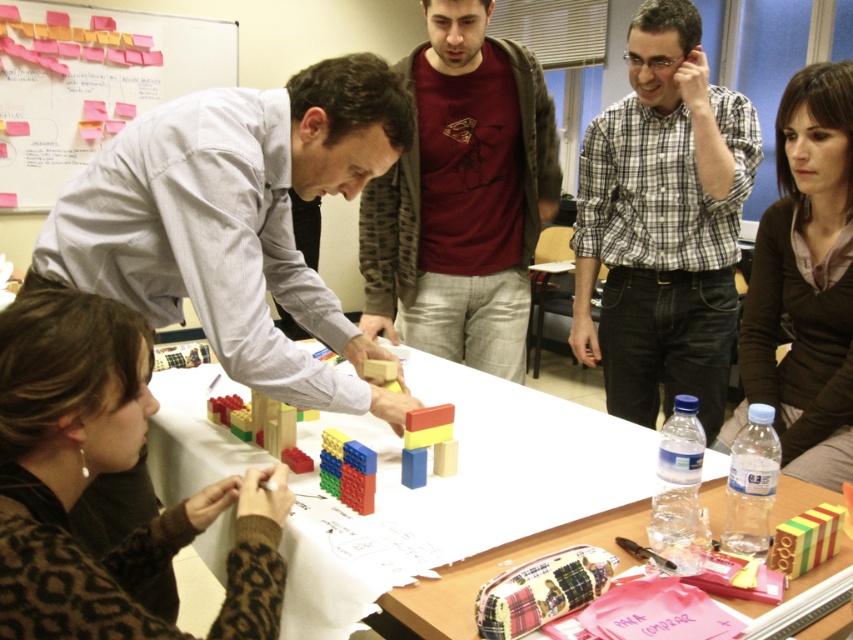
Which is more to the right, maroon t-shirt at center or rubberized plastic blocks at center?

maroon t-shirt at center is more to the right.

Image resolution: width=853 pixels, height=640 pixels. What do you see at coordinates (462, 196) in the screenshot?
I see `maroon t-shirt at center` at bounding box center [462, 196].

Who is more forward, (500, 321) or (444, 451)?

Point (444, 451) is more forward.

Locate an element on the screen. maroon t-shirt at center is located at coordinates (462, 196).

From the picture: Which is more to the left, white plastic table at center or wooden toy blocks at center?

white plastic table at center

This screenshot has height=640, width=853. What do you see at coordinates (463, 490) in the screenshot?
I see `white plastic table at center` at bounding box center [463, 490].

You are a GUI agent. You are given a task and a screenshot of the screen. Output one action in this format:
    pyautogui.click(x=<x>, y=<y>)
    Task: Click on the white plastic table at center
    The height and width of the screenshot is (640, 853).
    Given the screenshot: What is the action you would take?
    pyautogui.click(x=463, y=490)

Looking at this image, does brown zippered jacket at upper right have a lesser height compared to whiteboard with sticky notes at upper left?

Correct, brown zippered jacket at upper right is not as tall as whiteboard with sticky notes at upper left.

The height and width of the screenshot is (640, 853). I want to click on brown zippered jacket at upper right, so click(805, 284).

The image size is (853, 640). Find the location of `brown zippered jacket at upper right`. brown zippered jacket at upper right is located at coordinates point(805,284).

At what (x,y) coordinates should I click in order to perform the action: click on brown zippered jacket at upper right. Please return your answer as a coordinate pair (x, y). Looking at the image, I should click on (805, 284).